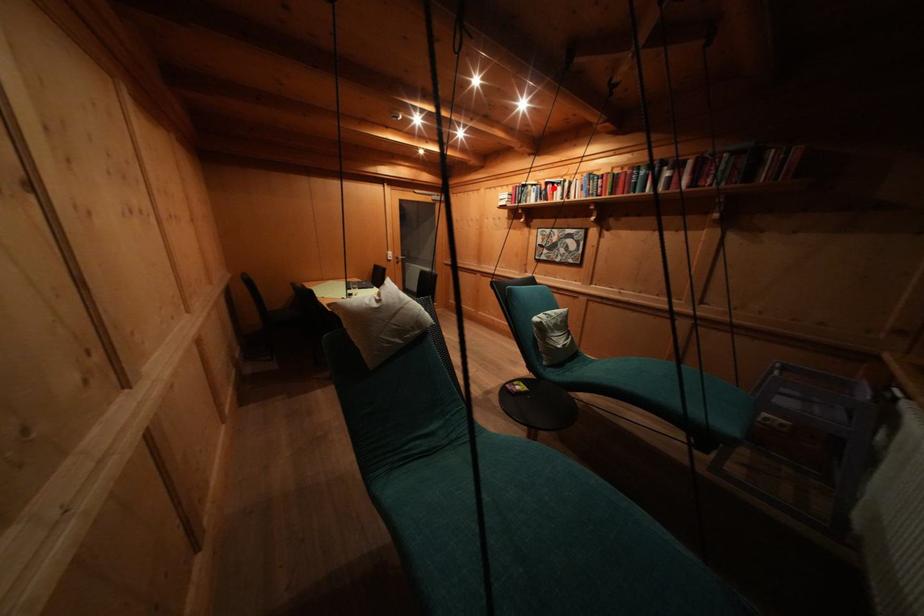
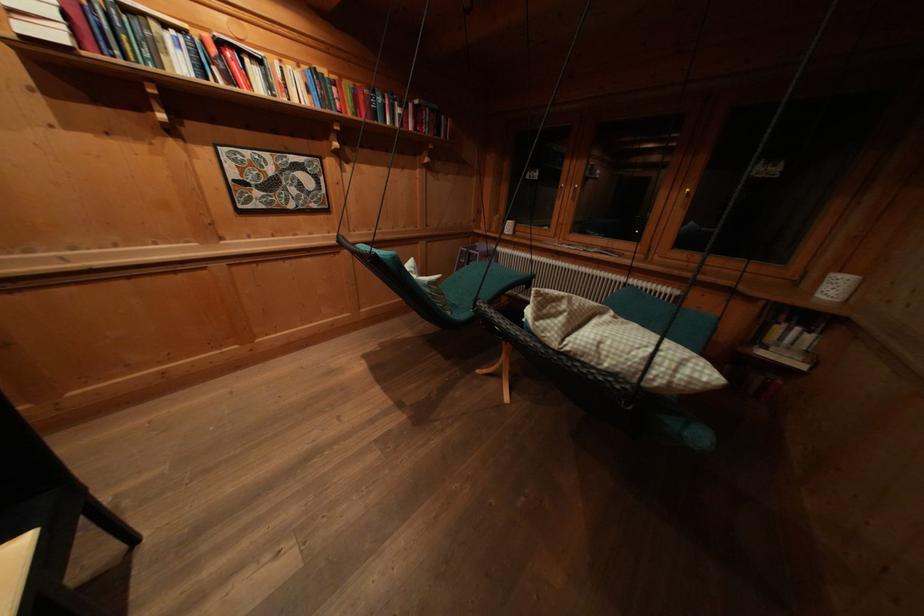
Question: I am providing you with two images of the same scene from different viewpoints. Given a red point in image1, look at the same physical point in image2. Is it:

Choices:
 (A) Closer to the viewpoint
 (B) Farther from the viewpoint

Answer: (B)